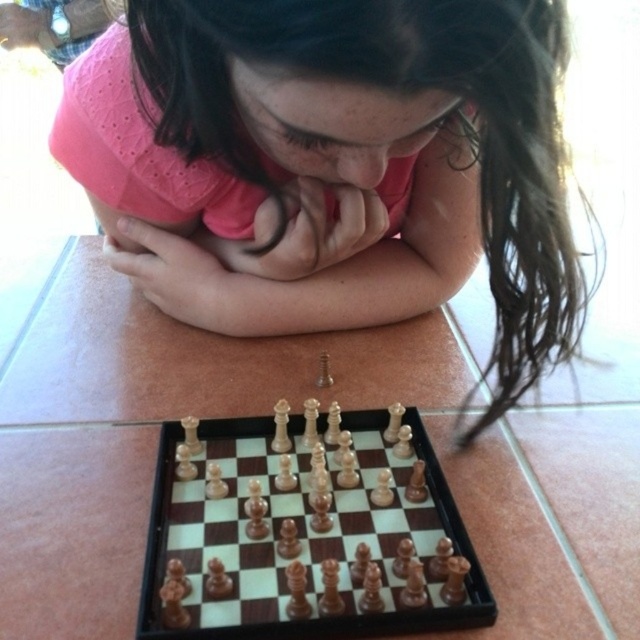
Question: Can you confirm if pink matte shirt at center is positioned above wooden chess set at center?

Choices:
 (A) yes
 (B) no

Answer: (A)

Question: Is pink matte shirt at center smaller than wooden chess set at center?

Choices:
 (A) no
 (B) yes

Answer: (A)

Question: Which of the following is the farthest from the observer?

Choices:
 (A) (488, 44)
 (B) (148, 531)

Answer: (B)

Question: Can you confirm if pink matte shirt at center is bigger than wooden chess set at center?

Choices:
 (A) no
 (B) yes

Answer: (B)

Question: Among these objects, which one is farthest from the camera?

Choices:
 (A) pink matte shirt at center
 (B) wooden chess set at center

Answer: (B)